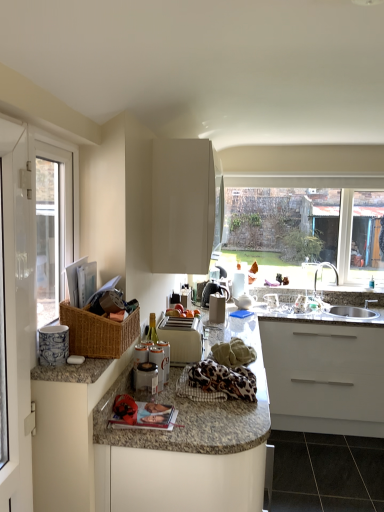
Question: Looking at the image, does granite at lower right seem bigger or smaller compared to white plastic window frame at left?

Choices:
 (A) big
 (B) small

Answer: (A)

Question: Is granite at lower right spatially inside white plastic window frame at left, or outside of it?

Choices:
 (A) outside
 (B) inside

Answer: (A)

Question: Which is farther from the metallic silver cans at center, the second appliance from the left?

Choices:
 (A) leopard print fabric at center
 (B) white glossy toaster at center, which is the second appliance from right to left
 (C) granite countertop at center, the first cabinetry when ordered from bottom to top
 (D) white glossy screen door at left
 (E) white plastic dish rack at center, the 5th appliance positioned from the left

Answer: (E)

Question: Which of these objects is positioned closest to the white plastic toaster at center, marked as the 3th appliance in a right-to-left arrangement?

Choices:
 (A) leopard print fabric at center
 (B) granite at lower right
 (C) white plastic dish rack at center, the 1th appliance viewed from the back
 (D) white glossy cabinet at upper center, placed as the 1th cabinetry when sorted from top to bottom
 (E) silver metallic faucet at right

Answer: (A)